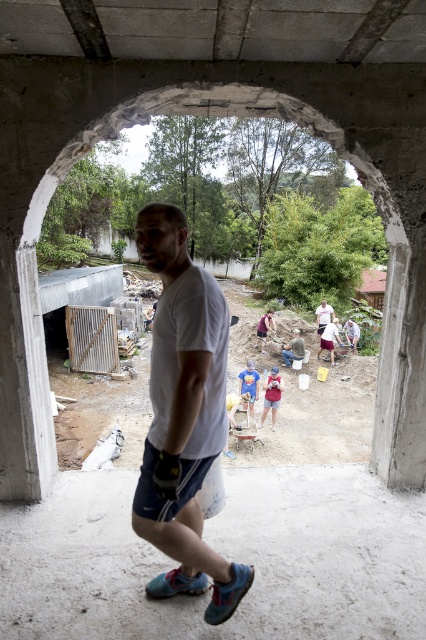
Question: Does matte red shorts at center have a lesser width compared to pink fabric shorts at center?

Choices:
 (A) yes
 (B) no

Answer: (A)

Question: Which of these objects is positioned farthest from the white matte t-shirt at center?

Choices:
 (A) pink fabric shorts at center
 (B) concrete at center
 (C) blue denim shorts at center

Answer: (A)

Question: Can you confirm if matte red shorts at center is positioned to the right of blue denim shorts at center?

Choices:
 (A) yes
 (B) no

Answer: (B)

Question: Which point is closer to the camera?

Choices:
 (A) matte red shorts at center
 (B) white matte t-shirt at center

Answer: (B)

Question: Can you confirm if blue denim shorts at center is positioned below pink fabric shorts at center?

Choices:
 (A) no
 (B) yes

Answer: (B)

Question: Which object is the closest to the concrete at center?

Choices:
 (A) pink fabric shorts at center
 (B) blue denim shorts at center

Answer: (B)